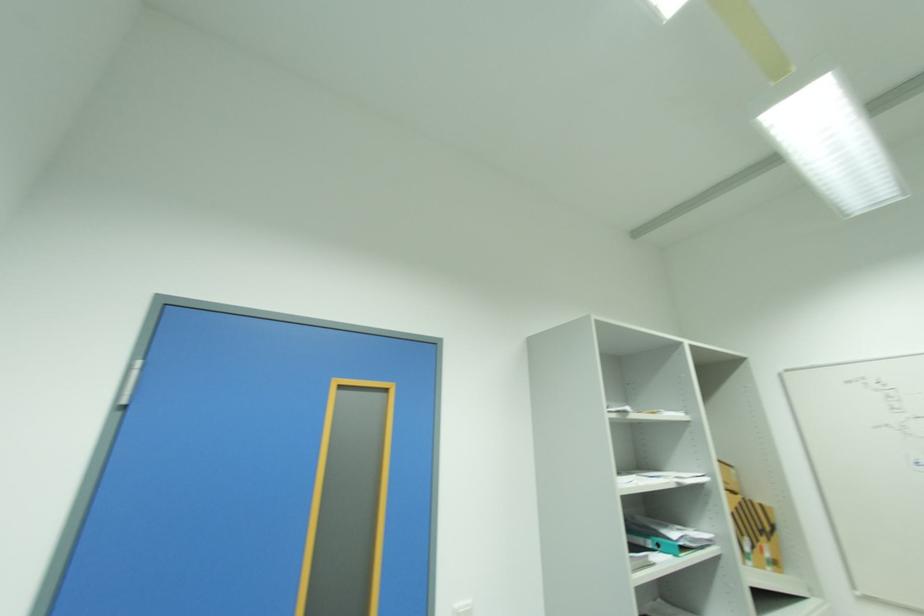
Where would you push the white light switch? Please return your answer as a coordinate pair (x, y).

(463, 594)